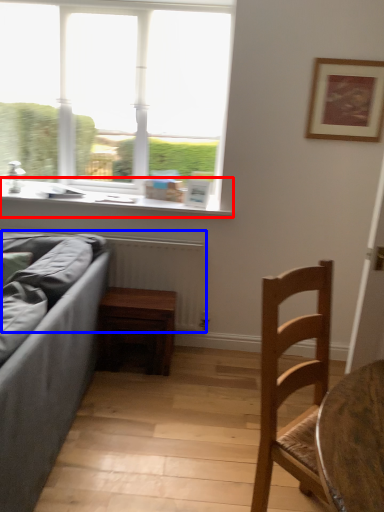
Question: Which point is further to the camera, window sill (highlighted by a red box) or radiator (highlighted by a blue box)?

Choices:
 (A) window sill
 (B) radiator

Answer: (A)